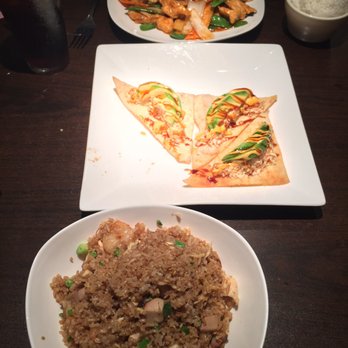
Locate an element on the screen. This screenshot has width=348, height=348. square plate is located at coordinates (199, 63).